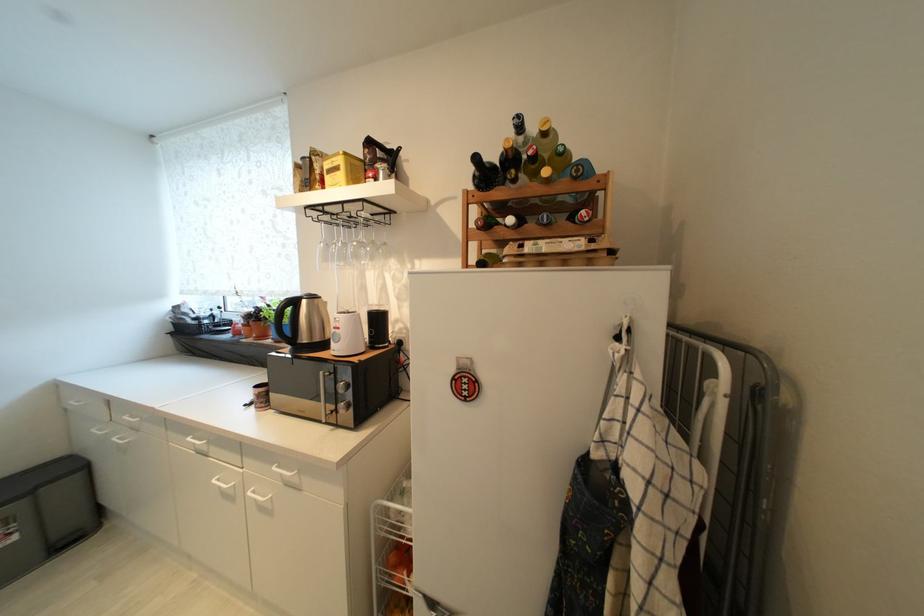
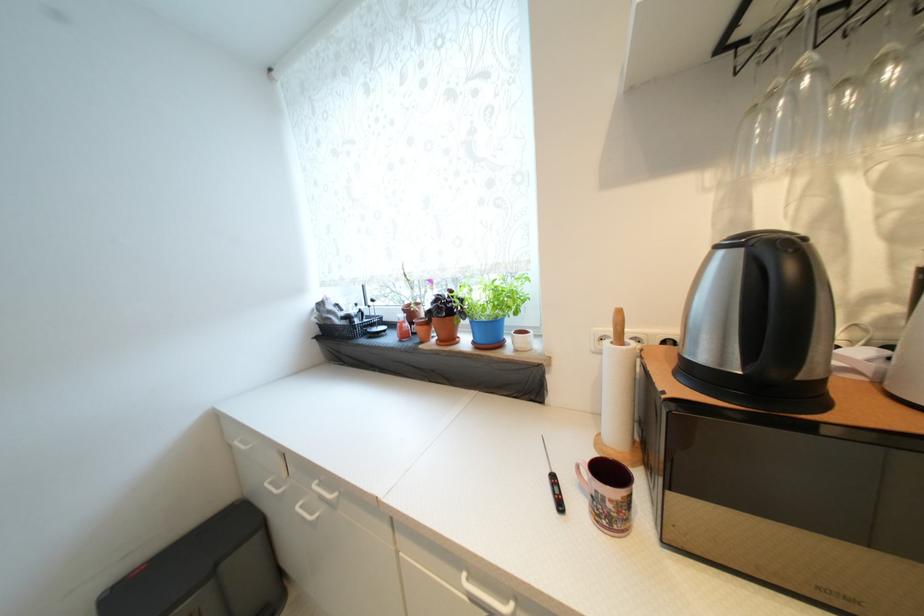
Where in the second image is the point corresponding to (x=82, y=477) from the first image?

(261, 541)